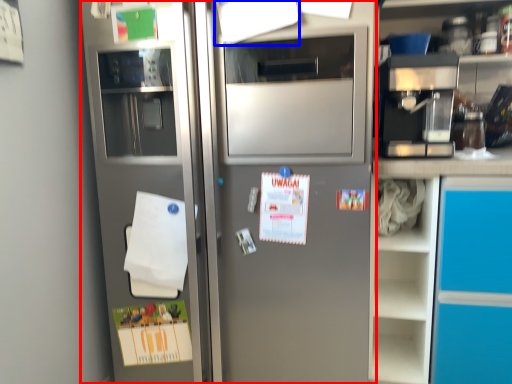
Question: Which object is closer to the camera taking this photo, refrigerator (highlighted by a red box) or paper (highlighted by a blue box)?

Choices:
 (A) refrigerator
 (B) paper

Answer: (A)